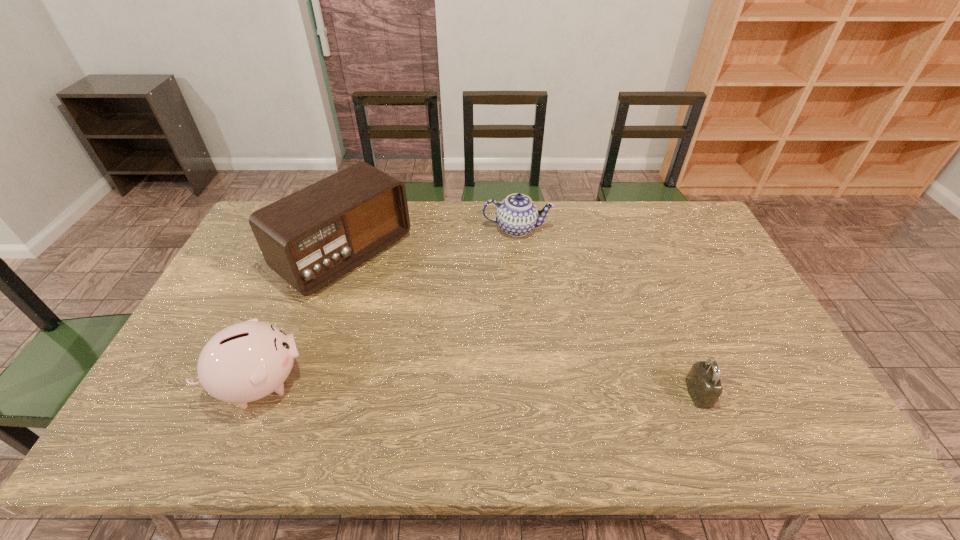
Locate an element on the screen. blank space located 0.390m on the front-facing side of the tallest object is located at coordinates (483, 355).

This screenshot has width=960, height=540. Identify the location of free space located at the spout of the second shortest object. (507, 289).

I want to click on vacant space positioned 0.240m at the spout of the second shortest object, so click(507, 292).

Where is `blank area located at the spout of the second shortest object`? This screenshot has width=960, height=540. blank area located at the spout of the second shortest object is located at coordinates (511, 261).

Locate an element on the screen. radio receiver positioned at the far edge is located at coordinates (310, 238).

At what (x,y) coordinates should I click in order to perform the action: click on chinaware located at the far edge. Please return your answer as a coordinate pair (x, y). Image resolution: width=960 pixels, height=540 pixels. Looking at the image, I should click on (517, 215).

Locate an element on the screen. piggy bank present at the near edge is located at coordinates (247, 361).

You are a GUI agent. You are given a task and a screenshot of the screen. Output one action in this format:
    pyautogui.click(x=<x>, y=<y>)
    Task: Click on the padlock that is at the near edge
    The image size is (960, 540).
    Given the screenshot: What is the action you would take?
    pyautogui.click(x=703, y=382)

Where is `piggy bank situated at the left edge`? The image size is (960, 540). piggy bank situated at the left edge is located at coordinates (247, 361).

Where is `radio receiver that is positioned at the left edge`? Image resolution: width=960 pixels, height=540 pixels. radio receiver that is positioned at the left edge is located at coordinates (310, 238).